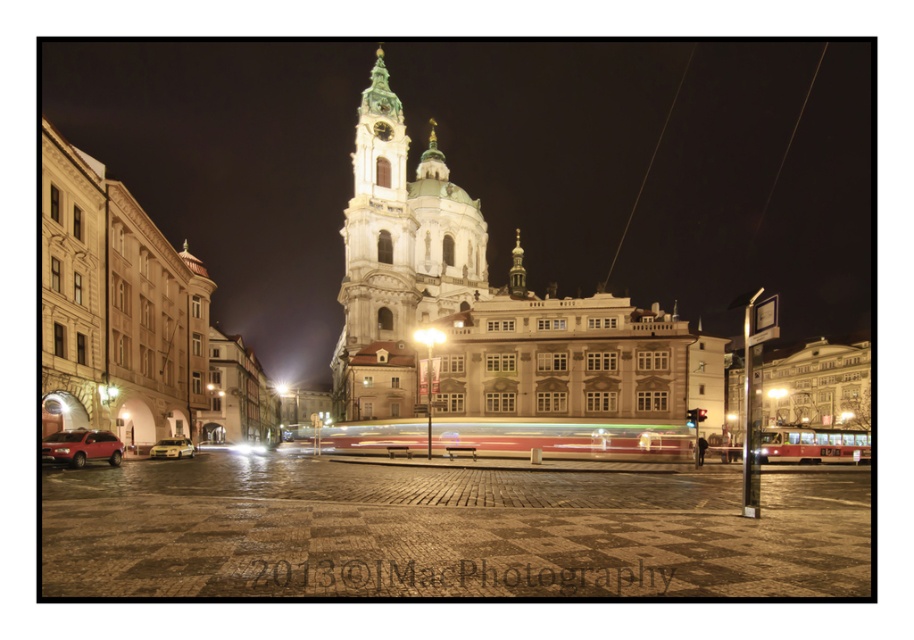
Can you confirm if white stone church at center is positioned above metallic gold car at lower left?

Yes, white stone church at center is above metallic gold car at lower left.

Which is behind, point (476, 410) or point (165, 456)?

The point (476, 410) is more distant.

You are a GUI agent. You are given a task and a screenshot of the screen. Output one action in this format:
    pyautogui.click(x=<x>, y=<y>)
    Task: Click on the white stone church at center
    
    Given the screenshot: What is the action you would take?
    pyautogui.click(x=473, y=307)

At what (x,y) coordinates should I click in order to perform the action: click on white stone church at center. Please return your answer as a coordinate pair (x, y). This screenshot has width=914, height=640. Looking at the image, I should click on (473, 307).

Which is below, brick pavement at center or white stone church at center?

Positioned lower is brick pavement at center.

Is brick pavement at center positioned behind white stone church at center?

No, brick pavement at center is closer to the viewer.

The height and width of the screenshot is (640, 914). Find the location of `brick pavement at center`. brick pavement at center is located at coordinates (447, 529).

Is point (96, 444) closer to viewer compared to point (167, 445)?

Yes, it is in front of point (167, 445).

Can you confirm if matte red suv at lower left is wider than metallic gold car at lower left?

Correct, the width of matte red suv at lower left exceeds that of metallic gold car at lower left.

Between point (61, 454) and point (165, 440), which one is positioned in front?

Point (61, 454) is in front.

At what (x,y) coordinates should I click in order to perform the action: click on matte red suv at lower left. Please return your answer as a coordinate pair (x, y). This screenshot has width=914, height=640. Looking at the image, I should click on (81, 445).